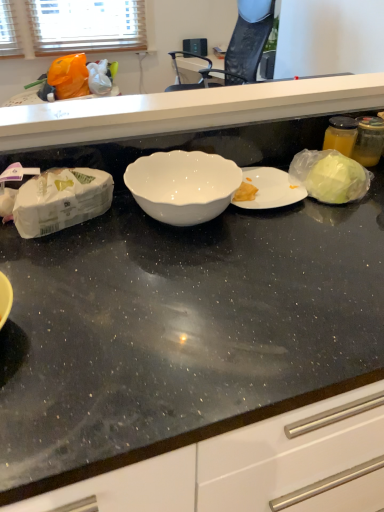
Question: Looking at their shapes, would you say white glossy bowl at center is wider or thinner than white glossy countertop at center?

Choices:
 (A) thin
 (B) wide

Answer: (B)

Question: Is white glossy bowl at center to the left or to the right of white glossy countertop at center in the image?

Choices:
 (A) left
 (B) right

Answer: (A)

Question: Considering the positions of point (228, 162) and point (155, 97), is point (228, 162) closer or farther from the camera than point (155, 97)?

Choices:
 (A) farther
 (B) closer

Answer: (B)

Question: Based on their positions, is white glossy countertop at center located to the left or right of white glossy bowl at center?

Choices:
 (A) left
 (B) right

Answer: (B)

Question: From the image's perspective, relative to white glossy bowl at center, is white glossy countertop at center above or below?

Choices:
 (A) above
 (B) below

Answer: (A)

Question: Considering the positions of white glossy countertop at center and white glossy bowl at center in the image, is white glossy countertop at center bigger or smaller than white glossy bowl at center?

Choices:
 (A) small
 (B) big

Answer: (B)

Question: Is white glossy countertop at center taller or shorter than white glossy bowl at center?

Choices:
 (A) short
 (B) tall

Answer: (B)